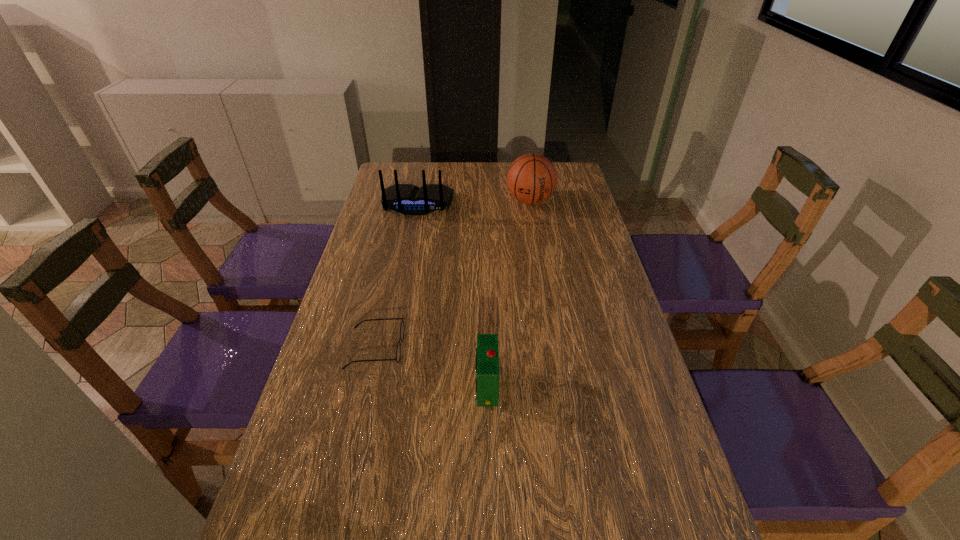
Select which object is the closest to the router. Please provide its 2D coordinates. Your answer should be formatted as a tuple, i.e. [(x, y)], where the tuple contains the x and y coordinates of a point satisfying the conditions above.

[(532, 178)]

Identify the location of object that ranks as the third closest to the basketball. (487, 353).

Locate an element on the screen. vacant position in the image that satisfies the following two spatial constraints: 1. on the surface of the basketball near the brand logo; 2. on the front-facing side of the alarm clock is located at coordinates (560, 386).

Locate an element on the screen. The image size is (960, 540). blank space that satisfies the following two spatial constraints: 1. on the back of the router; 2. on the front-facing side of the spectacles is located at coordinates (389, 348).

At what (x,y) coordinates should I click in order to perform the action: click on free space that satisfies the following two spatial constraints: 1. on the surface of the rightmost object near the brand logo; 2. on the front-facing side of the third object from left to right. Please return your answer as a coordinate pair (x, y). This screenshot has width=960, height=540. Looking at the image, I should click on (560, 386).

Where is `free location that satisfies the following two spatial constraints: 1. on the surface of the rightmost object near the brand logo; 2. on the front-facing side of the spectacles`? This screenshot has height=540, width=960. free location that satisfies the following two spatial constraints: 1. on the surface of the rightmost object near the brand logo; 2. on the front-facing side of the spectacles is located at coordinates (554, 348).

Identify the location of free spot that satisfies the following two spatial constraints: 1. on the surface of the rightmost object near the brand logo; 2. on the front-facing side of the shortest object. The image size is (960, 540). (554, 348).